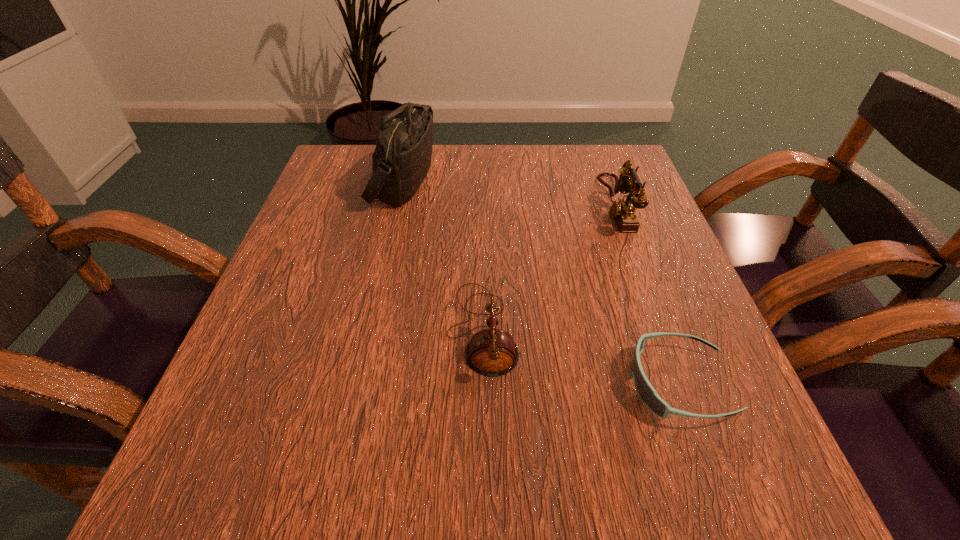
At what (x,y) coordinates should I click in order to perform the action: click on vacant area situated on the front-facing side of the right telephone. Please return your answer as a coordinate pair (x, y). The width and height of the screenshot is (960, 540). Looking at the image, I should click on (571, 205).

Locate an element on the screen. The image size is (960, 540). vacant space situated on the rotary dial of the left telephone is located at coordinates (331, 329).

You are a GUI agent. You are given a task and a screenshot of the screen. Output one action in this format:
    pyautogui.click(x=<x>, y=<y>)
    Task: Click on the vacant area situated 0.160m on the rotary dial of the left telephone
    
    Given the screenshot: What is the action you would take?
    pyautogui.click(x=349, y=329)

The image size is (960, 540). Identify the location of free spot located 0.200m on the rotary dial of the left telephone. (325, 329).

The width and height of the screenshot is (960, 540). I want to click on vacant space located 0.100m on the front-facing side of the shortest object, so click(x=561, y=384).

The height and width of the screenshot is (540, 960). In order to click on vacant space positioned on the front-facing side of the shortest object in this screenshot , I will do `click(554, 384)`.

Locate an element on the screen. vacant area situated on the front-facing side of the shortest object is located at coordinates (520, 384).

The height and width of the screenshot is (540, 960). What are the coordinates of `shoulder bag positioned at the far edge` in the screenshot? It's located at (401, 160).

Locate an element on the screen. Image resolution: width=960 pixels, height=540 pixels. telephone at the far edge is located at coordinates (622, 211).

What are the coordinates of `object present at the left edge` in the screenshot? It's located at (401, 160).